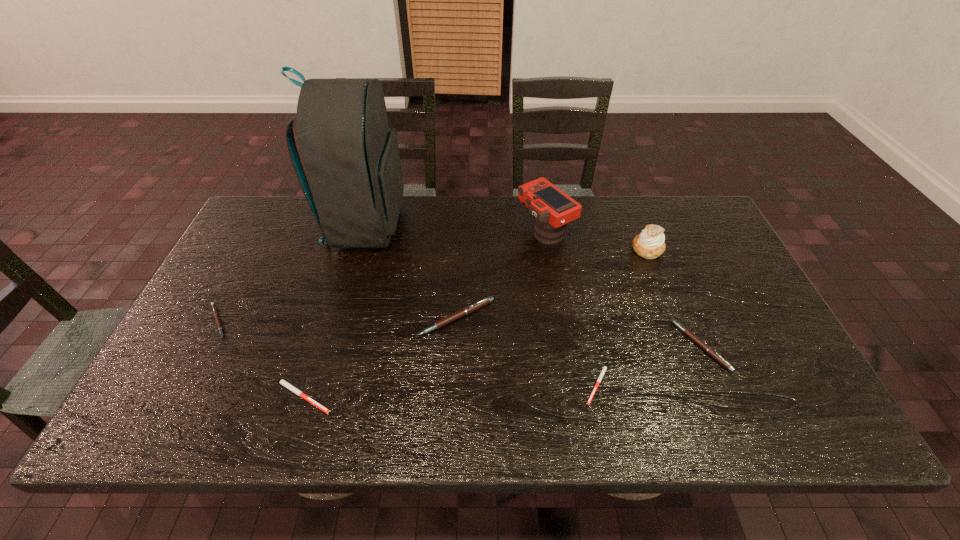
The image size is (960, 540). I want to click on the left white pen, so click(x=281, y=381).

Locate an element on the screen. This screenshot has height=540, width=960. the fourth pen from right to left is located at coordinates (281, 381).

Identify the location of the right white pen. (605, 367).

Identify the location of the shortest pen. The image size is (960, 540). (605, 367).

Where is `vacant space located 0.310m on the front-facing side of the tallest object`? The image size is (960, 540). vacant space located 0.310m on the front-facing side of the tallest object is located at coordinates (503, 225).

At what (x,y) coordinates should I click in order to perform the action: click on vacant area situated on the right of the seventh shortest object. Please return your answer as a coordinate pair (x, y). Image resolution: width=960 pixels, height=540 pixels. Looking at the image, I should click on (662, 231).

Where is `free space located on the front of the third tallest object`? free space located on the front of the third tallest object is located at coordinates (662, 288).

The height and width of the screenshot is (540, 960). I want to click on vacant region located at the nib of the second pink pen from right to left, so click(x=453, y=389).

Find the location of a particular element. This screenshot has height=540, width=960. free region located at the nib of the second biggest pink pen is located at coordinates (528, 346).

You are a GUI agent. You are given a task and a screenshot of the screen. Output one action in this format:
    pyautogui.click(x=<x>, y=<y>)
    Task: Click on the vacant position located at the nib of the second biggest pink pen
    The height and width of the screenshot is (540, 960).
    Given the screenshot: What is the action you would take?
    pyautogui.click(x=631, y=346)